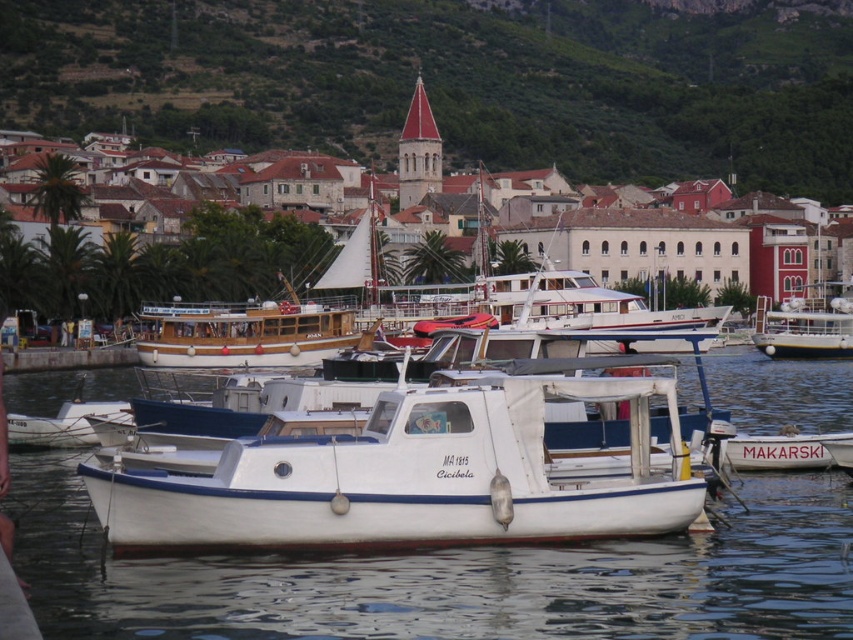
Is white glossy water at center to the right of white matte boat at center from the viewer's perspective?

Incorrect, white glossy water at center is not on the right side of white matte boat at center.

Is point (54, 376) in front of point (775, 464)?

No, (54, 376) is further to viewer.

You are a GUI agent. You are given a task and a screenshot of the screen. Output one action in this format:
    pyautogui.click(x=<x>, y=<y>)
    Task: Click on the white glossy water at center
    The width and height of the screenshot is (853, 640).
    Given the screenshot: What is the action you would take?
    pyautogui.click(x=450, y=577)

Which is below, green grassy hillside at upper center or white stone buildings at center?

Positioned lower is white stone buildings at center.

Does point (341, 36) come closer to viewer compared to point (280, 260)?

No, it is not.

Identify the location of green grassy hillside at upper center. (456, 81).

Is white glossy water at center taller than white matte boat at right?

Incorrect, white glossy water at center's height is not larger of white matte boat at right's.

Between white glossy water at center and white matte boat at right, which one has more height?

With more height is white matte boat at right.

Locate an element on the screen. This screenshot has width=853, height=640. white glossy water at center is located at coordinates (450, 577).

The image size is (853, 640). I want to click on white glossy water at center, so click(x=450, y=577).